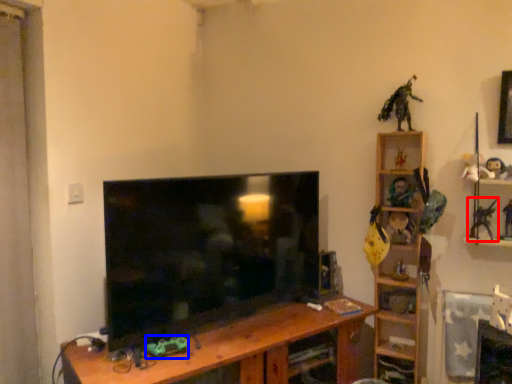
Question: Among these objects, which one is nearest to the camera, toy (highlighted by a red box) or toy (highlighted by a blue box)?

Choices:
 (A) toy
 (B) toy

Answer: (B)